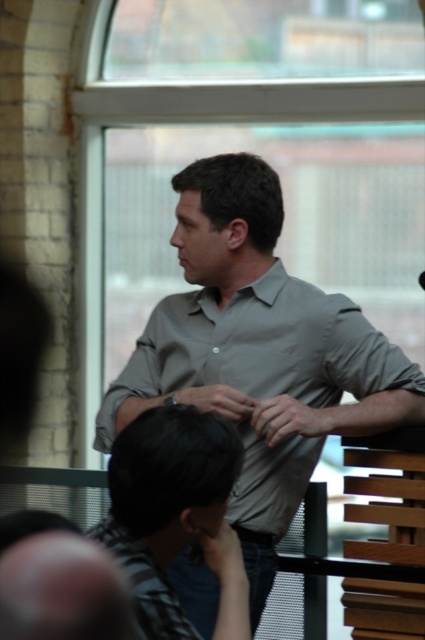
Can you confirm if matte black hand at lower center is taller than matte gray wristwatch at center?

Yes, matte black hand at lower center is taller than matte gray wristwatch at center.

Who is higher up, matte black hand at lower center or matte gray wristwatch at center?

matte gray wristwatch at center

Is point (206, 545) in front of point (192, 392)?

Yes, point (206, 545) is closer to viewer.

Locate an element on the screen. The image size is (425, 640). matte black hand at lower center is located at coordinates (223, 556).

Between gray matte shirt at center and matte black hand at lower center, which one is positioned lower?

Positioned lower is matte black hand at lower center.

Between point (379, 419) and point (220, 538), which one is positioned in front?

Point (220, 538) is more forward.

What are the coordinates of `gray matte shirt at center` in the screenshot? It's located at (255, 317).

Is point (189, 544) farther from camera compared to point (274, 401)?

No, it is not.

Is point (116, 552) farther from camera compared to point (319, 429)?

That is False.

The image size is (425, 640). Find the location of `black striped shirt at lower center`. black striped shirt at lower center is located at coordinates (167, 502).